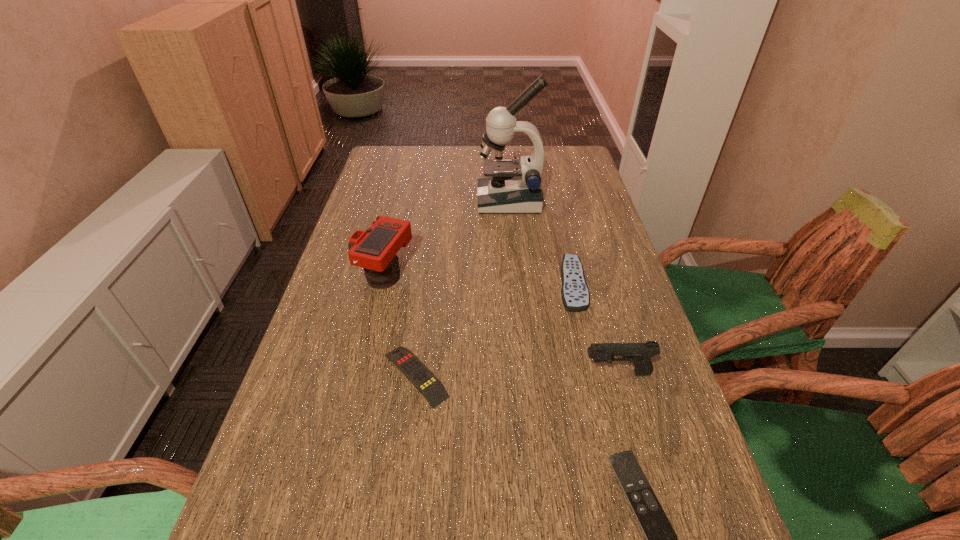
Locate an element on the screen. This screenshot has width=960, height=540. vacant space situated 0.300m at the barrel of the pistol is located at coordinates (442, 373).

In order to click on vacant space situated 0.390m on the back of the farthest remote control in this screenshot , I will do `click(549, 186)`.

Locate an element on the screen. free space located on the back of the leftmost remote control is located at coordinates (431, 255).

I want to click on object that is at the left edge, so (x=375, y=249).

I want to click on pistol that is at the right edge, so click(x=640, y=354).

Identify the location of remote control at the right edge. (575, 296).

Identify the location of blank area at the far edge. (465, 147).

The image size is (960, 540). What are the coordinates of `free space at the left edge` in the screenshot? It's located at (331, 287).

The image size is (960, 540). Identify the location of vacant space at the right edge of the desktop. (724, 517).

What are the coordinates of `free location at the far left corner of the desktop` in the screenshot? It's located at (392, 157).